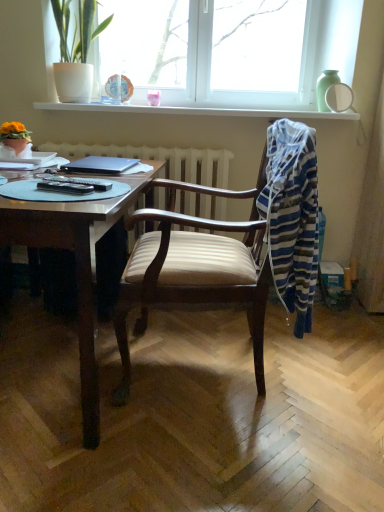
Identify the location of vacant space to the right of wooden chair at center. (329, 379).